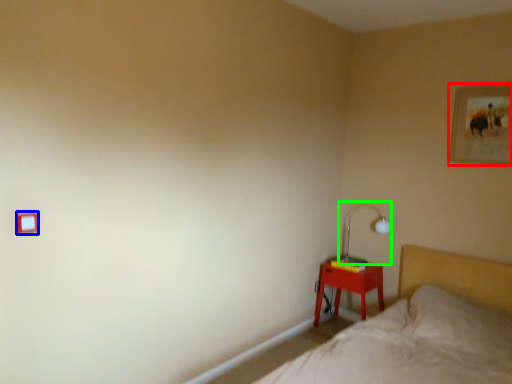
Question: Which is farther away from picture frame (highlighted by a red box)? light switch (highlighted by a blue box) or table lamp (highlighted by a green box)?

Choices:
 (A) light switch
 (B) table lamp

Answer: (A)